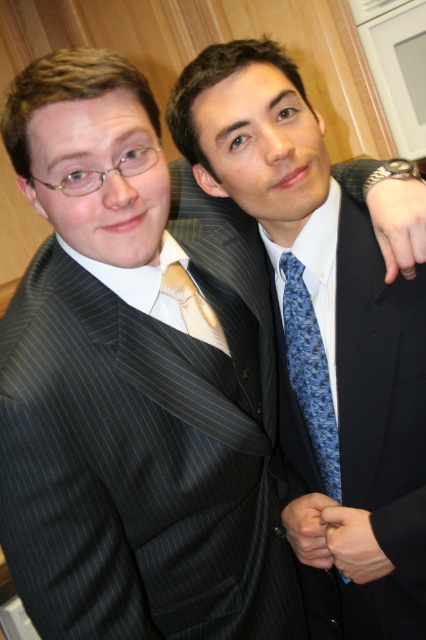
Question: Does pinstriped suit at center lie in front of satin gold tie at center?

Choices:
 (A) no
 (B) yes

Answer: (B)

Question: Among these points, which one is nearest to the camera?

Choices:
 (A) (192, 333)
 (B) (316, 408)

Answer: (A)

Question: Is pinstriped suit at center to the right of blue printed tie at center from the viewer's perspective?

Choices:
 (A) yes
 (B) no

Answer: (A)

Question: Which object is the closest to the blue printed tie at center?

Choices:
 (A) pinstriped suit at center
 (B) satin gold tie at center

Answer: (A)

Question: Is pinstriped suit at center positioned before satin gold tie at center?

Choices:
 (A) yes
 (B) no

Answer: (A)

Question: Among these points, which one is farthest from the camera?

Choices:
 (A) (175, 300)
 (B) (359, 182)

Answer: (B)